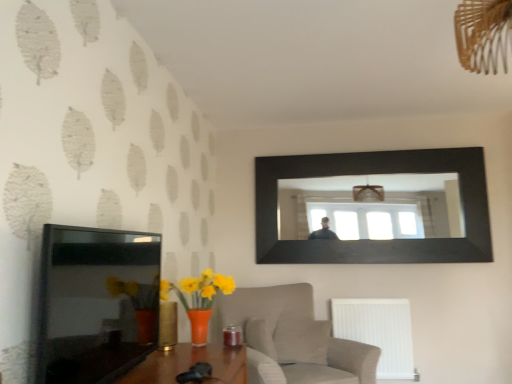
You are a GUI agent. You are given a task and a screenshot of the screen. Output one action in this format:
    pyautogui.click(x=<x>, y=<y>)
    Task: Click on the vacant point above black glossy picture frame at upper center, which is counted as the 2th picture frame, starting from the front (from a real-world perspective)
    
    Given the screenshot: What is the action you would take?
    [x=372, y=145]